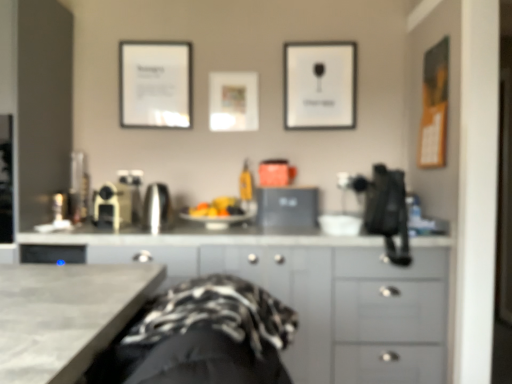
The height and width of the screenshot is (384, 512). I want to click on vacant space underneath satin silver kettle at center, the 2th appliance when ordered from left to right (from a real-world perspective), so click(x=154, y=231).